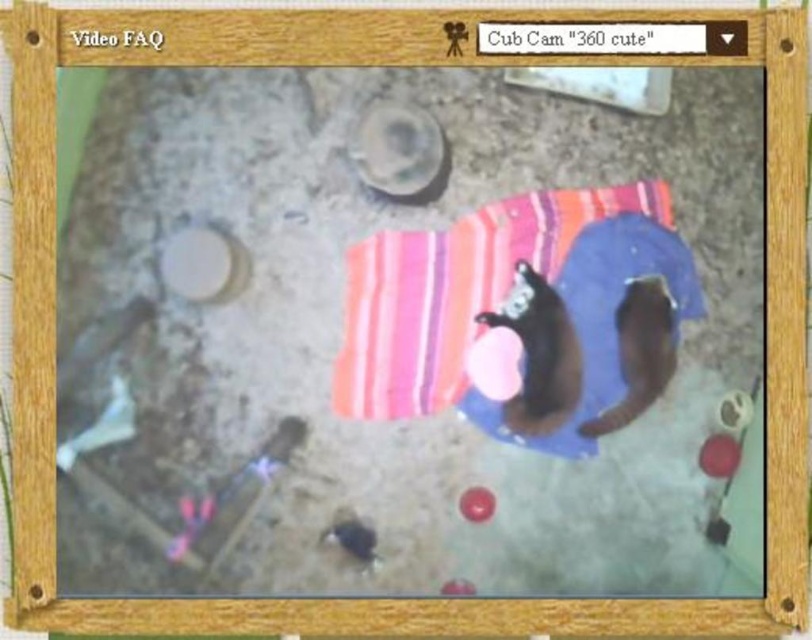
You are a photographer trying to capture a closeup of the striped cotton beach towel at center. Your camera has a minimum focusing distance of 80 centimeters. Can you take the photo without moving the camera?

The striped cotton beach towel at center and camera are 79.04 centimeters apart from each other, which is less than the camera minimum focusing distance of 80 centimeters. Therefore, you cannot take the photo without moving the camera closer.

You are a parent who wants to place a rubber ball at center on top of the striped cotton beach towel at center shown in the video feed. Based on their sizes, will the ball fit comfortably without falling off the edges?

The striped cotton beach towel at center is much taller than the rubber ball at center, so the ball will fit comfortably on the towel without falling off the edges.

You are a pet owner who wants to place a small toy between the black fur cat at center and the soft brown fur cat at center. Based on their positions, where should you place the toy so that it is between them?

The black fur cat at center is above the soft brown fur cat at center, so you should place the toy between them in the space below the black fur cat at center and above the soft brown fur cat at center.